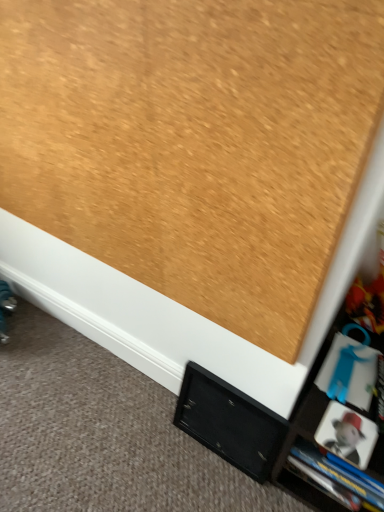
Question: In terms of height, does matte black cabinet at lower right look taller or shorter compared to black matte cabinet at lower center?

Choices:
 (A) short
 (B) tall

Answer: (A)

Question: Is matte black cabinet at lower right situated inside black matte cabinet at lower center or outside?

Choices:
 (A) inside
 (B) outside

Answer: (B)

Question: Estimate the real-world distances between objects in this image. Which object is closer to the blue plastic book at lower right?

Choices:
 (A) black matte cabinet at lower center
 (B) matte black cabinet at lower right

Answer: (B)

Question: Which is farther from the blue plastic book at lower right?

Choices:
 (A) black matte cabinet at lower center
 (B) matte black cabinet at lower right

Answer: (A)